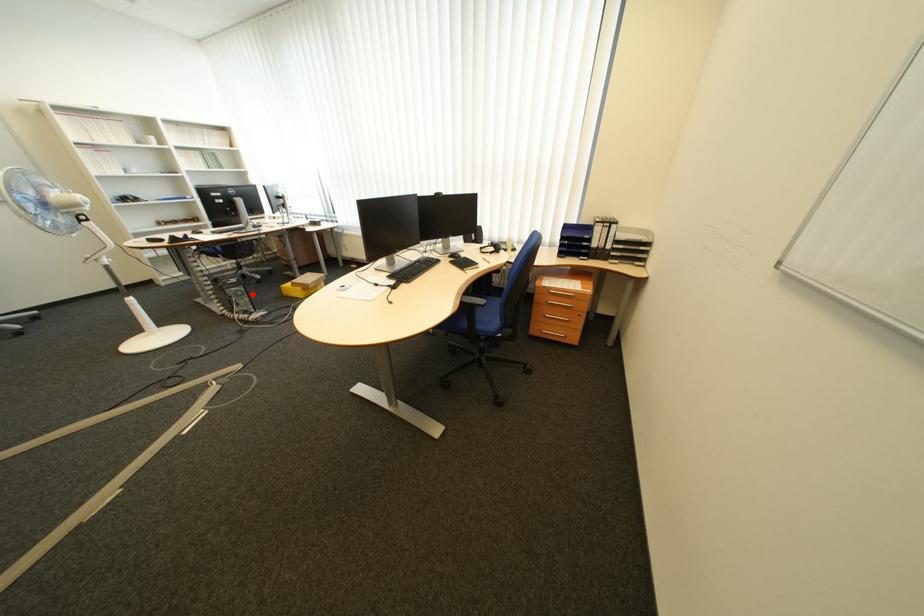
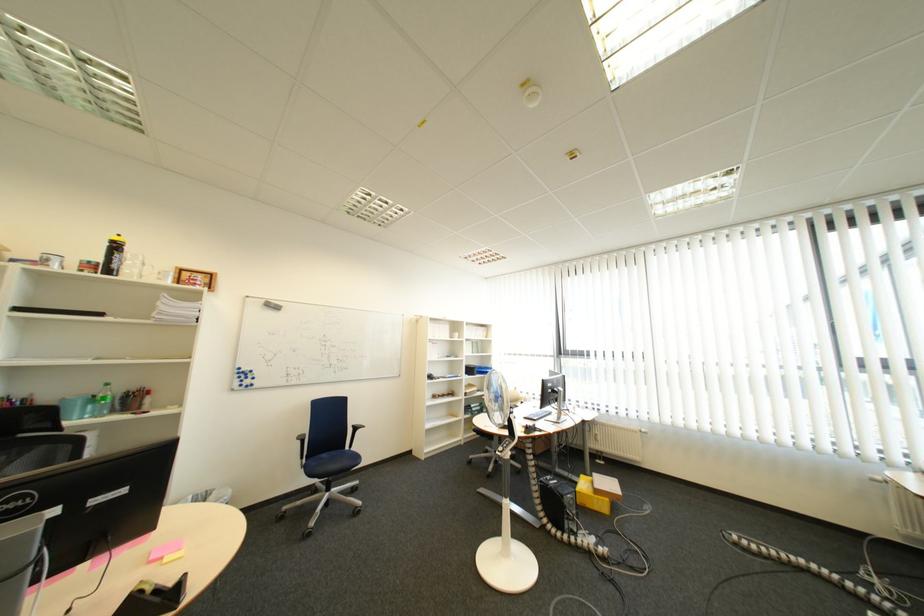
Question: I am providing you with two images of the same scene from different viewpoints. In image1, a red point is highlighted. Considering the same 3D point in image2, which of the following is correct?

Choices:
 (A) It is closer
 (B) It is farther

Answer: (B)